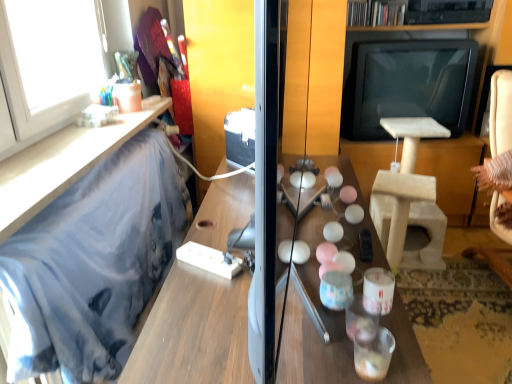
Question: Can you confirm if wooden table at center is taller than blue fabric at left, positioned as the 2th furniture in top-to-bottom order?

Choices:
 (A) no
 (B) yes

Answer: (A)

Question: Considering the relative sizes of wooden table at center and blue fabric at left, the first furniture when ordered from bottom to top, in the image provided, is wooden table at center smaller than blue fabric at left, the first furniture when ordered from bottom to top,?

Choices:
 (A) no
 (B) yes

Answer: (A)

Question: Is wooden table at center positioned behind blue fabric at left, the first furniture when ordered from bottom to top?

Choices:
 (A) no
 (B) yes

Answer: (A)

Question: From the image's perspective, is wooden table at center on blue fabric at left, the first furniture when ordered from bottom to top?

Choices:
 (A) no
 (B) yes

Answer: (A)

Question: Is wooden table at center facing away from blue fabric at left, positioned as the 2th furniture in top-to-bottom order?

Choices:
 (A) no
 (B) yes

Answer: (B)

Question: From the image's perspective, does wooden table at center appear lower than blue fabric at left, the first furniture when ordered from bottom to top?

Choices:
 (A) no
 (B) yes

Answer: (B)

Question: Is blue fabric at left, the first furniture when ordered from bottom to top, at the left side of beige fabric swivel chair at right?

Choices:
 (A) yes
 (B) no

Answer: (A)

Question: From a real-world perspective, is blue fabric at left, positioned as the 2th furniture in top-to-bottom order, located beneath beige fabric swivel chair at right?

Choices:
 (A) no
 (B) yes

Answer: (B)

Question: Does blue fabric at left, positioned as the 2th furniture in top-to-bottom order, have a greater width compared to beige fabric swivel chair at right?

Choices:
 (A) no
 (B) yes

Answer: (A)

Question: Is blue fabric at left, positioned as the 2th furniture in top-to-bottom order, closer to the viewer compared to beige fabric swivel chair at right?

Choices:
 (A) no
 (B) yes

Answer: (B)

Question: Considering the relative sizes of blue fabric at left, positioned as the 2th furniture in top-to-bottom order, and beige fabric swivel chair at right in the image provided, is blue fabric at left, positioned as the 2th furniture in top-to-bottom order, thinner than beige fabric swivel chair at right?

Choices:
 (A) yes
 (B) no

Answer: (A)

Question: Is blue fabric at left, positioned as the 2th furniture in top-to-bottom order, surrounding beige fabric swivel chair at right?

Choices:
 (A) yes
 (B) no

Answer: (B)

Question: From the image's perspective, is beige fabric swivel chair at right located beneath blue fabric at left, the second furniture in the bottom-to-top sequence?

Choices:
 (A) yes
 (B) no

Answer: (A)